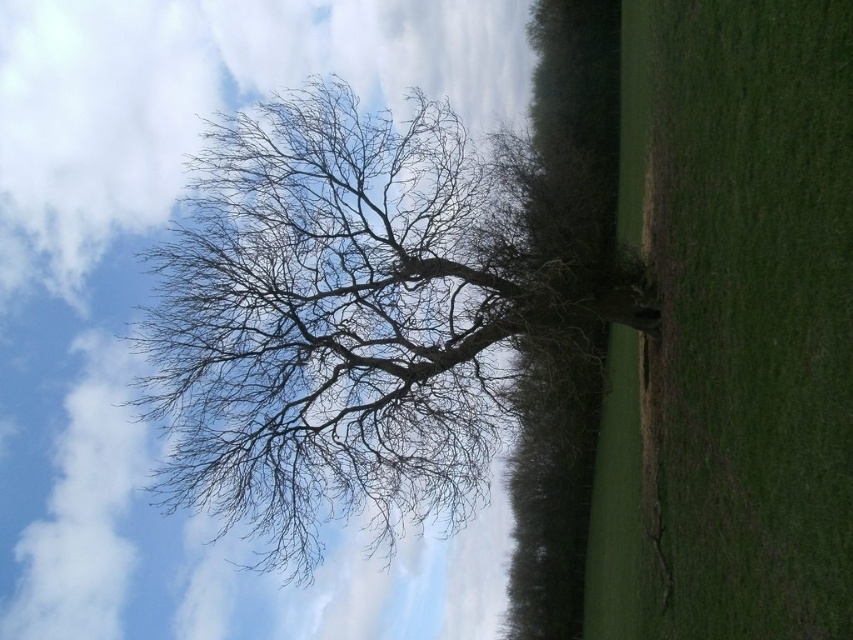
Question: Which of the following is the closest to the observer?

Choices:
 (A) (467, 314)
 (B) (607, 566)

Answer: (A)

Question: Does bare branches at center appear under green grassy field at center?

Choices:
 (A) yes
 (B) no

Answer: (A)

Question: From the image, what is the correct spatial relationship of bare branches at center in relation to green grassy field at center?

Choices:
 (A) left
 (B) right

Answer: (A)

Question: Does bare branches at center appear on the left side of green grassy field at center?

Choices:
 (A) yes
 (B) no

Answer: (A)